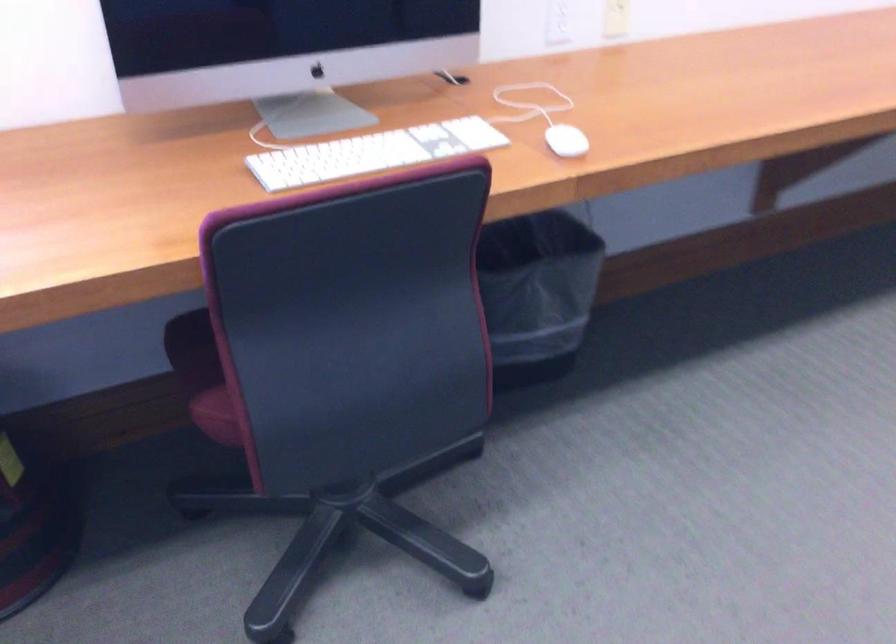
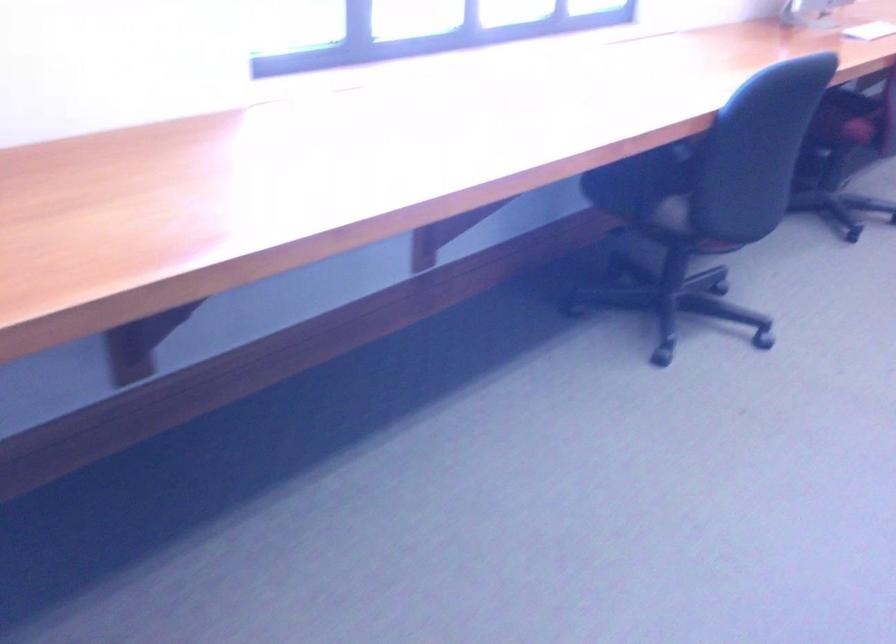
Which direction would the cameraman need to move to produce the second image?

The movement direction of the cameraman is left, backward.